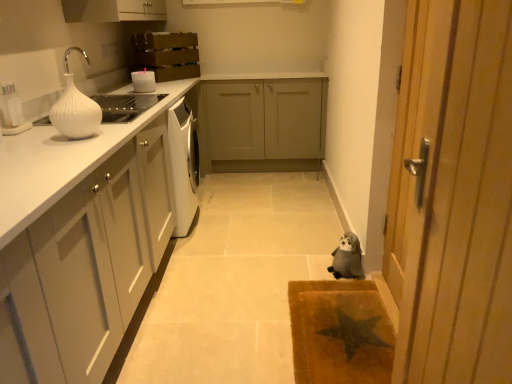
Image resolution: width=512 pixels, height=384 pixels. Find the location of `blank space above white glossy vase at upper left (from a real-world perspective)`. blank space above white glossy vase at upper left (from a real-world perspective) is located at coordinates (77, 81).